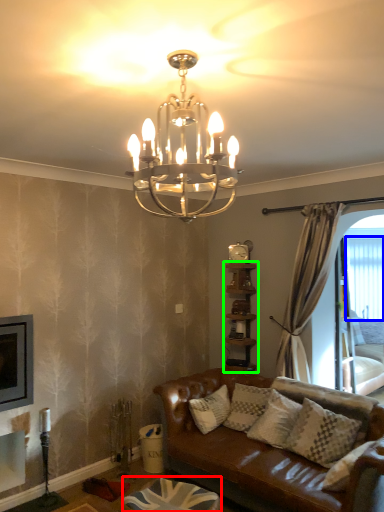
Question: Which object is the closest to the footrest (highlighted by a red box)? Choose among these: window screen (highlighted by a blue box) or shelf (highlighted by a green box).

Choices:
 (A) window screen
 (B) shelf

Answer: (B)